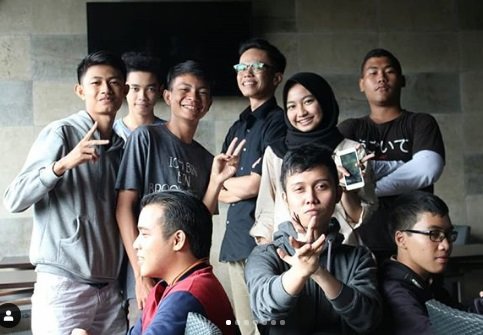
Where is `wall`? The height and width of the screenshot is (335, 483). wall is located at coordinates (435, 58).